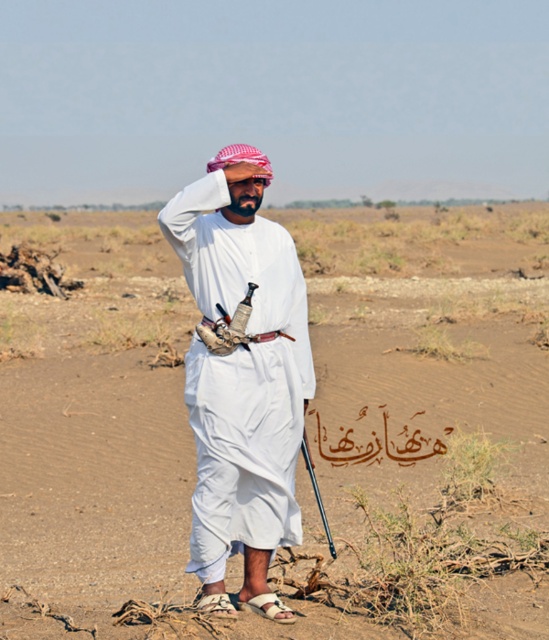
You are navigating through the desert and see two landmarks marked as point 1 at coordinates point (64, 609) and point 2 at coordinates point (227, 497). If you are facing north, which point is located behind you?

Point 1 at coordinates point (64, 609) is behind point 2 at coordinates point (227, 497), so if you are facing north, point 1 would be behind you.

From the picture: You are a photographer planning to take a portrait of the man in the desert scene. You want to ensure the brown sandy dirt field at center and the white matte clothing at center are both clearly visible in the photo. Based on their positions, which object should appear closer to the camera?

The brown sandy dirt field at center is further to the viewer than the white matte clothing at center, so the white matte clothing at center will appear closer to the camera in the photo.